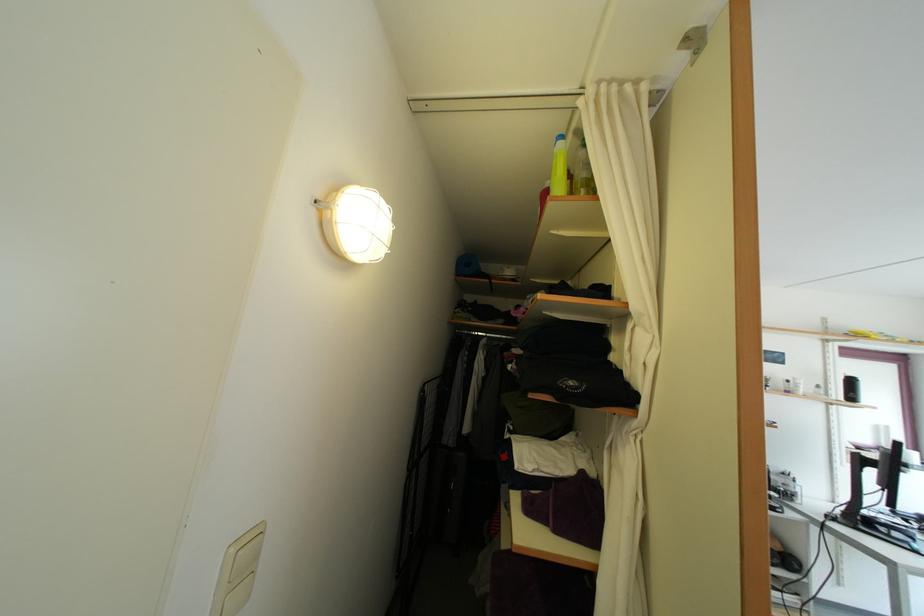
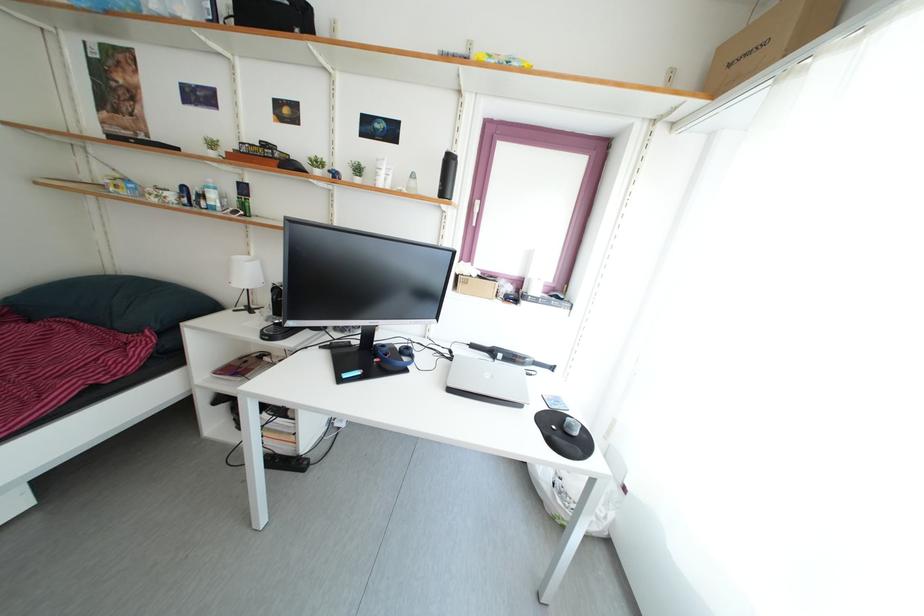
Question: In a continuous first-person perspective shot, in which direction is the camera moving?

Choices:
 (A) Left
 (B) Right
 (C) Forward
 (D) Backward

Answer: (B)